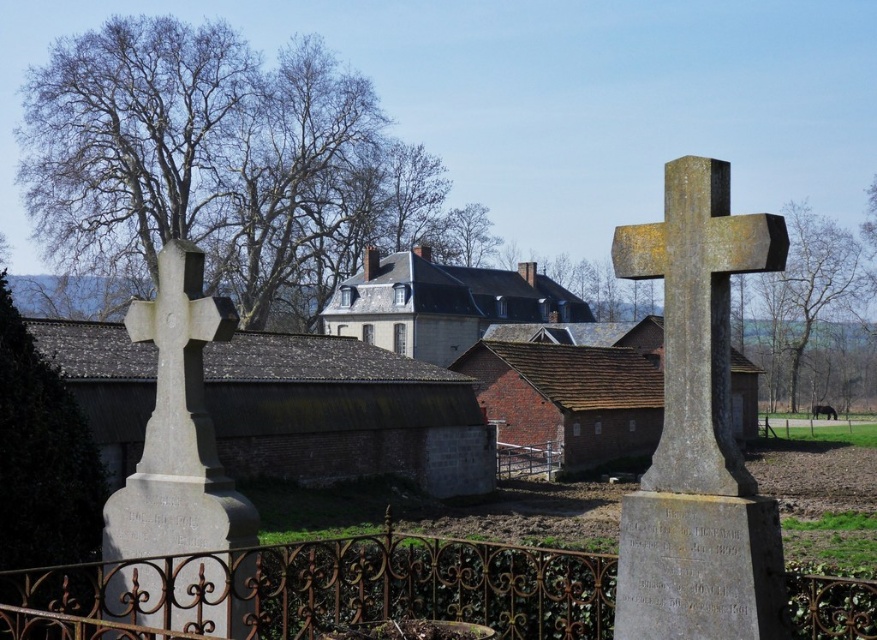
You are standing at the camera position and want to place a new flower pot 10 feet away from the gray stone cross at right. Can you determine if the flower pot will be placed within the cemetery area?

The gray stone cross at right is 18.68 feet away from the camera. Placing the flower pot 10 feet away from it would place it 8.68 feet from the camera, which is still within the cemetery area as the fence is at the bottom edge of the image.

You are standing in the cemetery and want to take a photo of the gray stone cross at right and the brown textured tree at upper center. Which object should you focus on first if you want to include both in your frame without moving the camera?

You should focus on the brown textured tree at upper center first because the gray stone cross at right is positioned on the right side of it, so keeping the tree centered will allow both objects to be in the frame.